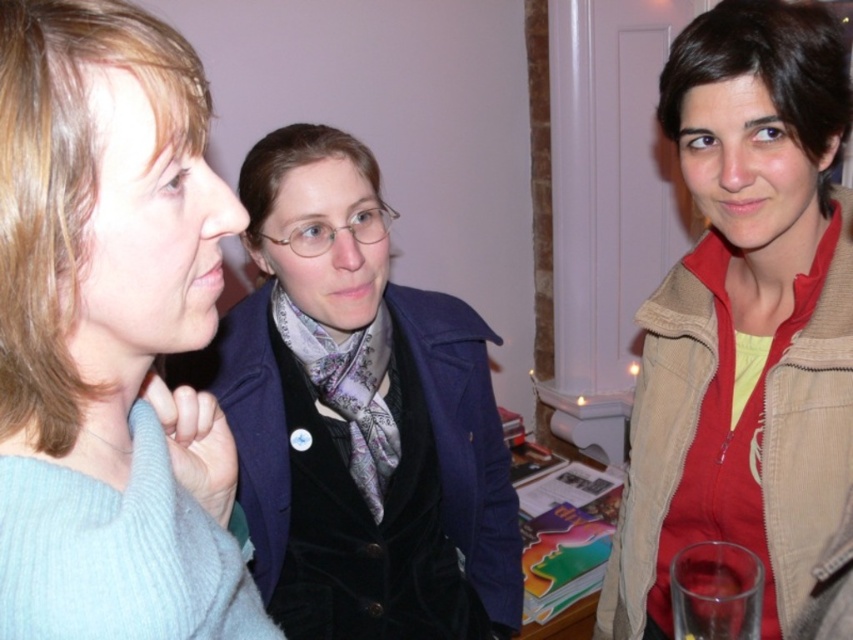
You are at a social gathering and want to grab a drink without disturbing others. You see the light blue sweater at left and the clear glass at lower right. Which object is closer to you?

The light blue sweater at left is closer to you since it is only 18.89 inches away from the clear glass at lower right, making the sweater the nearer object.

You are standing in the room and want to hand a gift to the person wearing the velvet blue coat at center without moving the person wearing the tan corduroy jacket at right. Is this possible?

The tan corduroy jacket at right is in front of the velvet blue coat at center, so you can step around the tan corduroy jacket at right to reach the velvet blue coat at center and hand the gift without moving them.

You are organizing a charity clothing drive and need to determine if the tan corduroy jacket at right and the velvet blue coat at center can fit into a standard donation box that measures 30x30x30 cm. Based on their sizes, can both items fit together in the box?

The tan corduroy jacket at right is smaller than the velvet blue coat at center. Since the velvet blue coat at center is larger, it might occupy more space. However, without exact dimensions, it is uncertain if both can fit together in the 30x30x30 cm donation box. Please check the individual sizes before deciding.